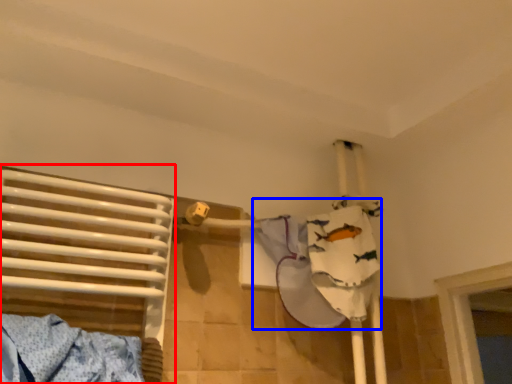
Question: Which object appears farthest to the camera in this image, bed (highlighted by a red box) or clothing (highlighted by a blue box)?

Choices:
 (A) bed
 (B) clothing

Answer: (B)